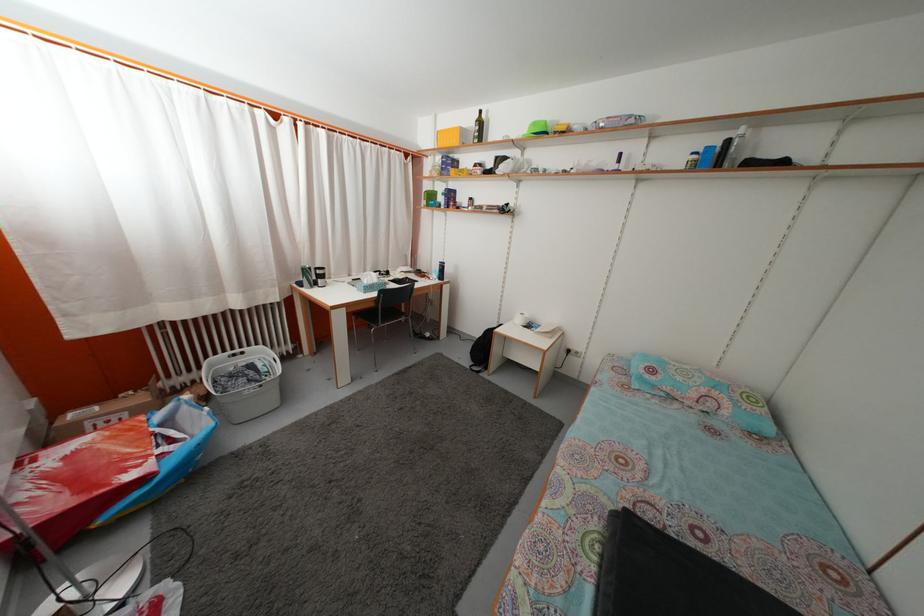
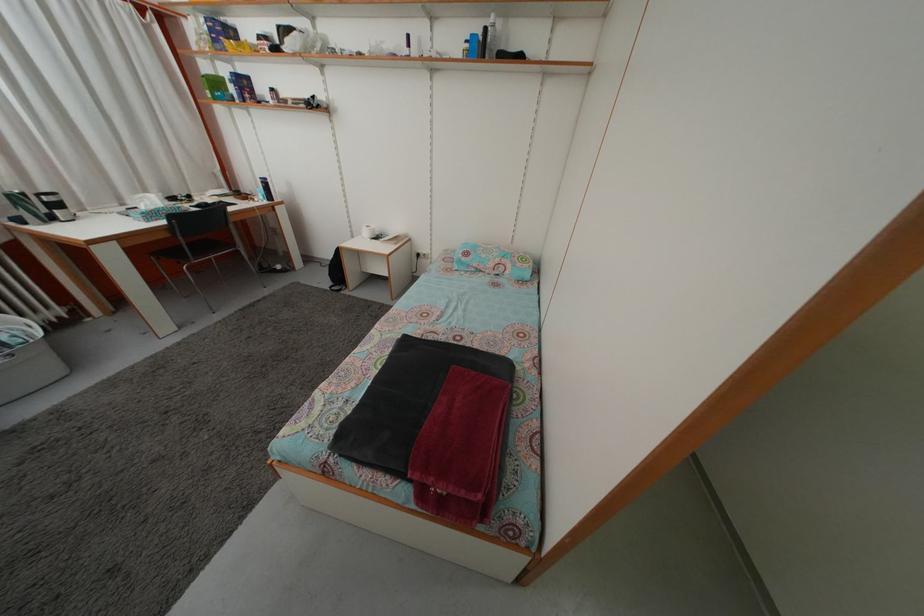
Locate, in the second image, the point that corresponds to [699,164] in the first image.

(473, 53)